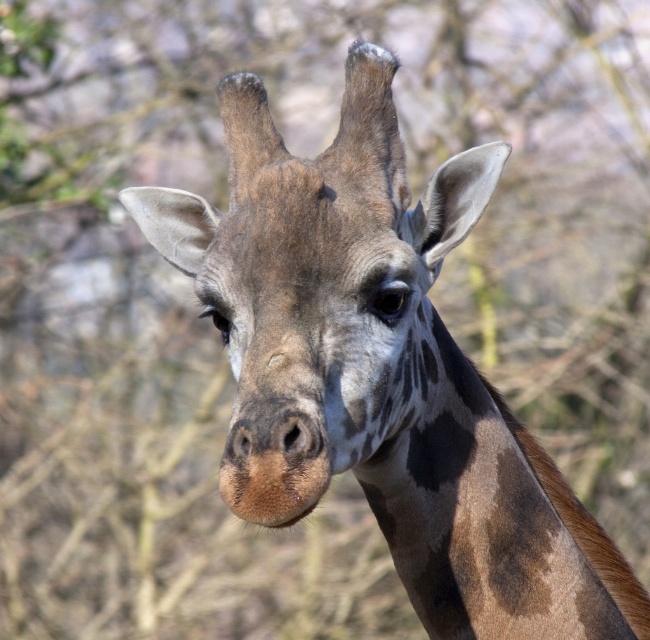
Consider the image. You are a wildlife photographer trying to capture a close shot of the brown spotted fur at center and the brown spotted neck at center of a giraffe. Based on the scene, which of these two features is wider?

The brown spotted fur at center is wider than the brown spotted neck at center.

You are a wildlife photographer trying to capture the giraffe in the image. You notice the brown spotted fur at center and the brown spotted neck at center. Which part of the giraffe is taller in the photo?

The brown spotted fur at center is taller than the brown spotted neck at center in the photo.